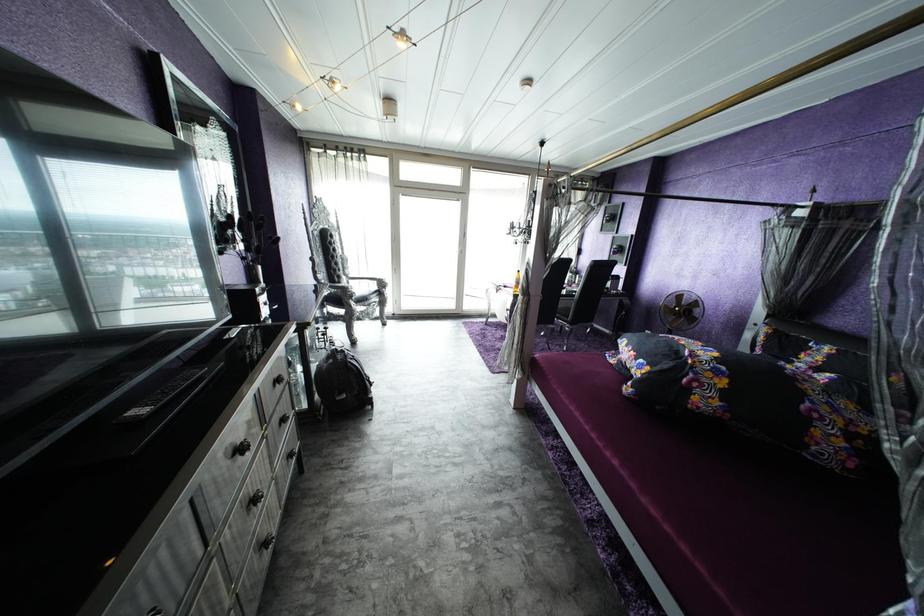
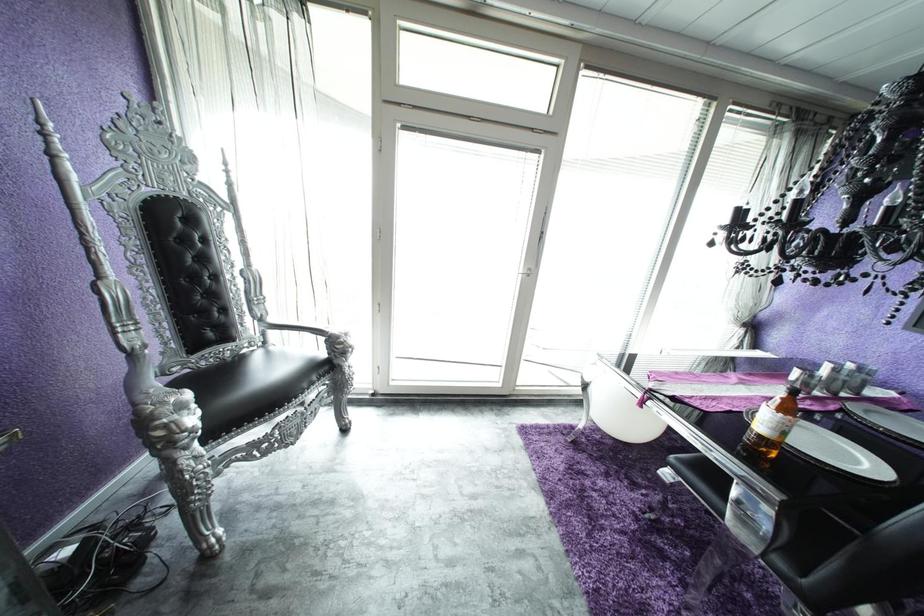
Question: What movement of the cameraman would produce the second image?

Choices:
 (A) Left
 (B) Right
 (C) Forward
 (D) Backward

Answer: (C)